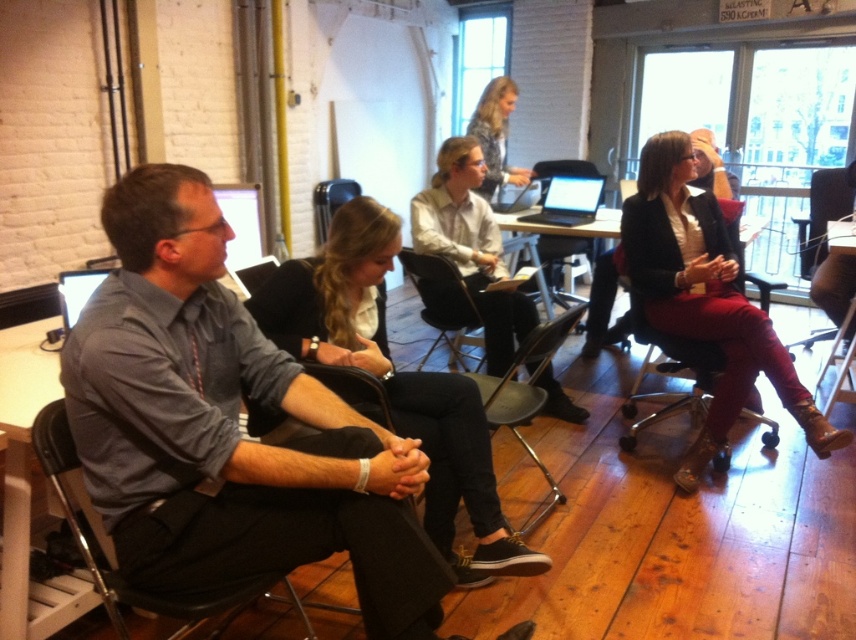
Which of these two, metallic black chair at center-right or silver metallic laptop at center, stands taller?

With more height is metallic black chair at center-right.

Can you confirm if metallic black chair at center-right is positioned to the left of silver metallic laptop at center?

No, metallic black chair at center-right is not to the left of silver metallic laptop at center.

Who is more distant from viewer, (700, 385) or (584, 186)?

The point (584, 186) is more distant.

I want to click on metallic black chair at center-right, so click(670, 372).

Can you confirm if matte gray shirt at center is bigger than silver metallic laptop at center?

Yes.

Between matte gray shirt at center and silver metallic laptop at center, which one is positioned lower?

Positioned lower is matte gray shirt at center.

Who is more distant from viewer, (73, 332) or (563, 211)?

The point (563, 211) is behind.

Identify the location of matte gray shirt at center. This screenshot has height=640, width=856. (229, 428).

Can you confirm if matte black blazer at center is positioned to the left of black plastic chair at left?

In fact, matte black blazer at center is to the right of black plastic chair at left.

Can you confirm if matte black blazer at center is shorter than black plastic chair at left?

In fact, matte black blazer at center may be taller than black plastic chair at left.

Is point (699, 460) positioned in front of point (94, 564)?

No, (699, 460) is behind (94, 564).

Identify the location of matte black blazer at center. Image resolution: width=856 pixels, height=640 pixels. (705, 300).